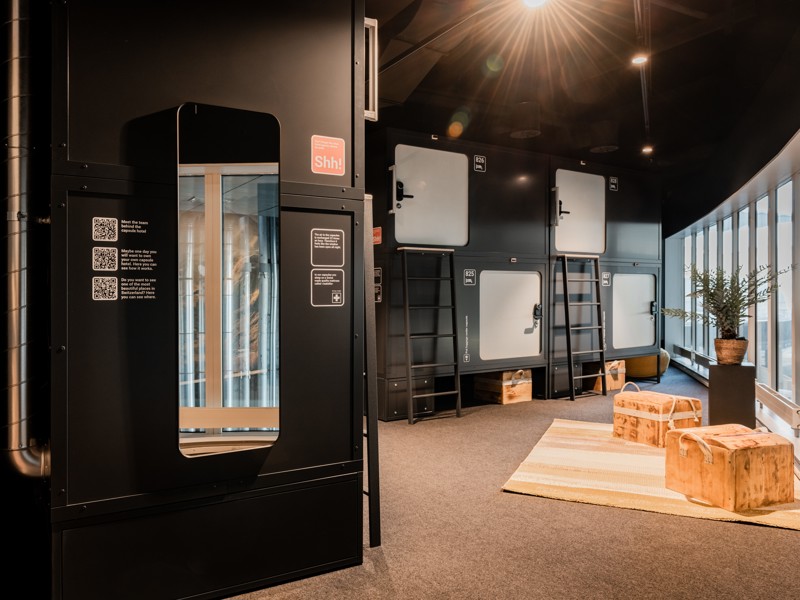
Locate an element on the screen. rug is located at coordinates (609, 470).